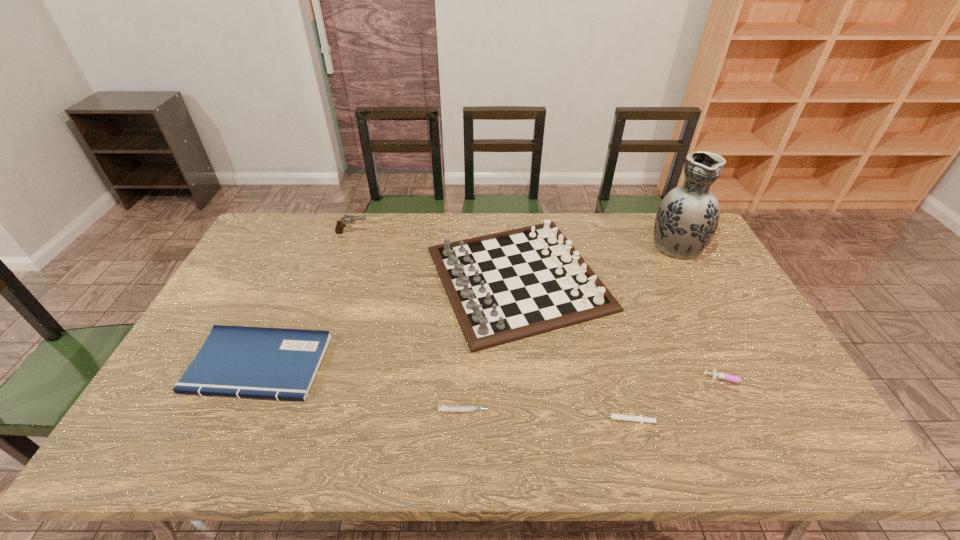
At what (x,y) coordinates should I click in order to perform the action: click on vacant region between the farthest syringe and the chessboard. Please return your answer as a coordinate pair (x, y). Image resolution: width=960 pixels, height=540 pixels. Looking at the image, I should click on (624, 329).

What are the coordinates of `free space between the second tallest syringe and the rightmost syringe` in the screenshot? It's located at tap(597, 395).

The width and height of the screenshot is (960, 540). I want to click on free spot between the second tallest syringe and the vase, so click(570, 327).

Locate an element on the screen. vacant region between the leftmost syringe and the paperback book is located at coordinates (361, 388).

Select which object is the sixth closest to the paperback book. Please provide its 2D coordinates. Your answer should be formatted as a tuple, i.e. [(x, y)], where the tuple contains the x and y coordinates of a point satisfying the conditions above.

[(687, 217)]

Image resolution: width=960 pixels, height=540 pixels. Identify the location of object that is the second closest to the pistol. (235, 361).

What are the coordinates of `syringe that is the closest one to the sixth shortest object` in the screenshot? It's located at (445, 408).

I want to click on syringe identified as the closest to the second nearest syringe, so click(x=640, y=419).

Where is `free space that satisfies the following two spatial constraints: 1. with the handle on the side of the tallest object; 2. at the barrel of the third tallest object`? free space that satisfies the following two spatial constraints: 1. with the handle on the side of the tallest object; 2. at the barrel of the third tallest object is located at coordinates (670, 233).

Locate an element on the screen. This screenshot has height=540, width=960. vacant area that satisfies the following two spatial constraints: 1. at the barrel of the chessboard; 2. on the left side of the fifth shortest object is located at coordinates (336, 279).